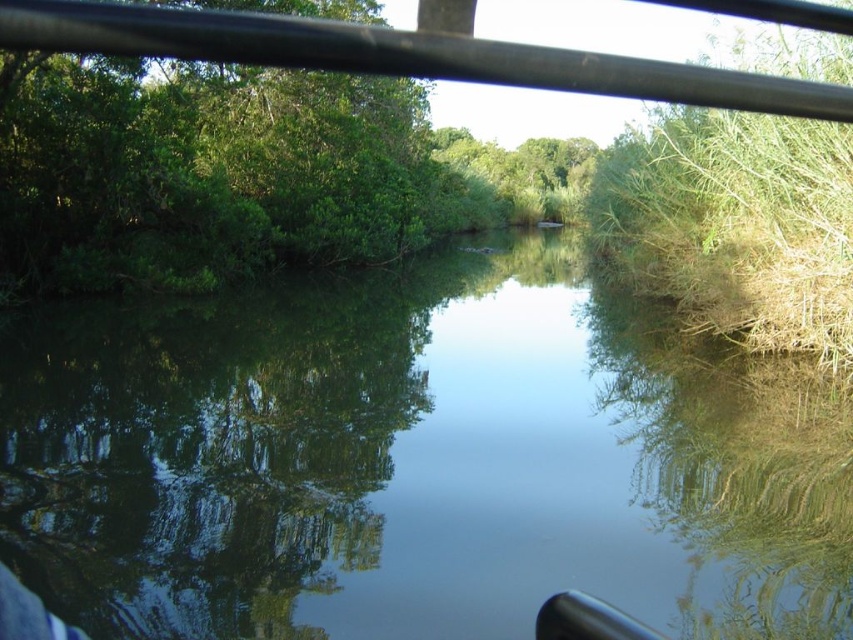
Question: Can you confirm if green reflective water at center is wider than black metal rail at upper center?

Choices:
 (A) no
 (B) yes

Answer: (B)

Question: Among these points, which one is nearest to the camera?

Choices:
 (A) (45, 42)
 (B) (811, 436)

Answer: (A)

Question: Which object appears farthest from the camera in this image?

Choices:
 (A) green reflective water at center
 (B) black metal rail at upper center

Answer: (A)

Question: Does green reflective water at center have a smaller size compared to black metal rail at upper center?

Choices:
 (A) yes
 (B) no

Answer: (B)

Question: Which point is farther to the camera?

Choices:
 (A) (231, 52)
 (B) (334, 308)

Answer: (B)

Question: Is green reflective water at center smaller than black metal rail at upper center?

Choices:
 (A) yes
 (B) no

Answer: (B)